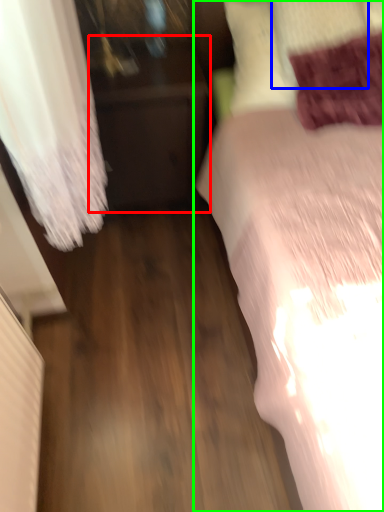
Question: Which is nearer to the furniture (highlighted by a red box)? pillow (highlighted by a blue box) or bed (highlighted by a green box).

Choices:
 (A) pillow
 (B) bed

Answer: (B)